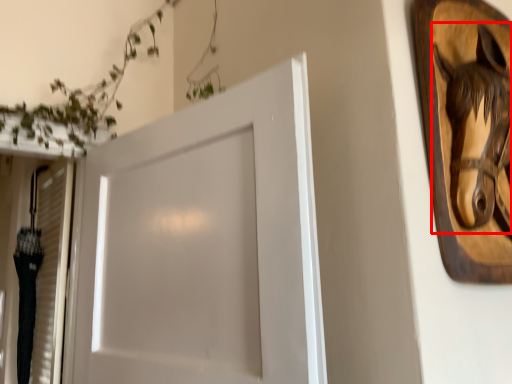
Question: From the image's perspective, what is the correct spatial relationship of animal (annotated by the red box) in relation to door?

Choices:
 (A) below
 (B) above

Answer: (B)